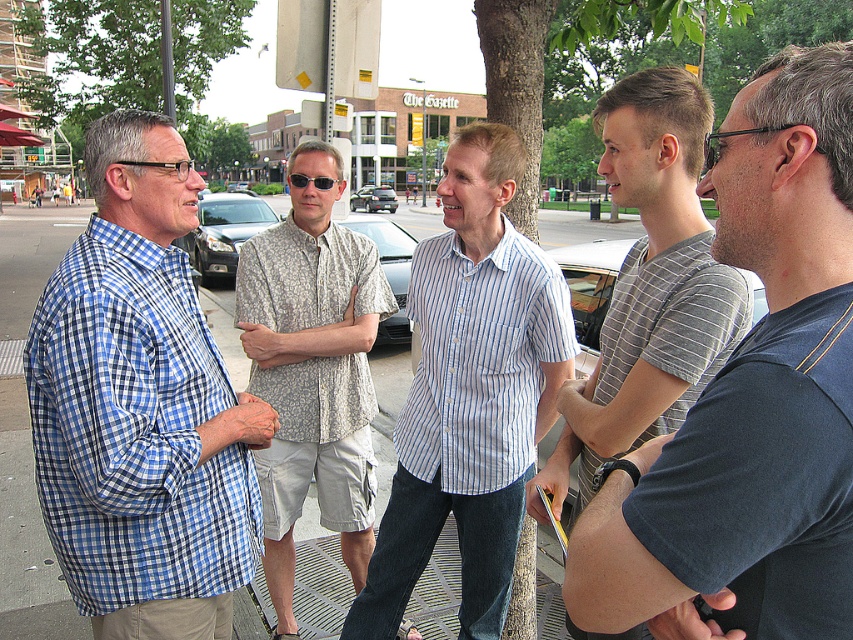
Which is below, gray striped shirt at right or gray striped shirt at center?

gray striped shirt at right

Can you confirm if gray striped shirt at right is bigger than gray striped shirt at center?

Incorrect, gray striped shirt at right is not larger than gray striped shirt at center.

Describe the element at coordinates (752, 397) in the screenshot. Image resolution: width=853 pixels, height=640 pixels. I see `gray striped shirt at right` at that location.

At what (x,y) coordinates should I click in order to perform the action: click on gray striped shirt at right. Please return your answer as a coordinate pair (x, y). Looking at the image, I should click on (752, 397).

Can you confirm if floral-patterned shirt at center is shorter than gray striped shirt at center?

Incorrect, floral-patterned shirt at center's height does not fall short of gray striped shirt at center's.

Does point (363, 470) come closer to viewer compared to point (666, 176)?

No, (363, 470) is behind (666, 176).

What are the coordinates of `floral-patterned shirt at center` in the screenshot? It's located at (312, 371).

Who is higher up, blue striped shirt at center or gray striped shirt at center?

gray striped shirt at center is higher up.

Which of these two, blue striped shirt at center or gray striped shirt at center, stands shorter?

gray striped shirt at center is shorter.

What do you see at coordinates (469, 392) in the screenshot?
I see `blue striped shirt at center` at bounding box center [469, 392].

Where is `blue striped shirt at center`? blue striped shirt at center is located at coordinates (469, 392).